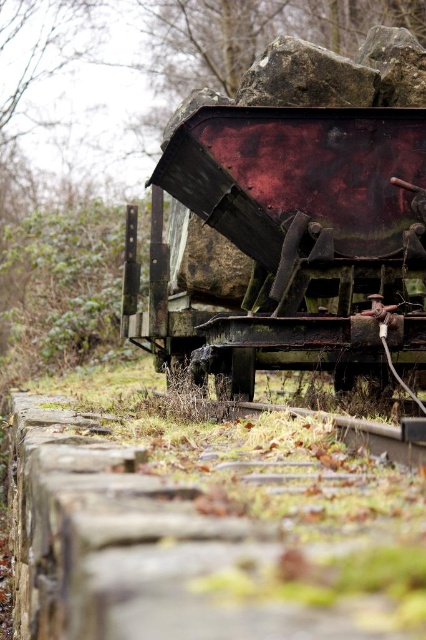
Question: Considering the relative positions of rusty metal train car at center and rusty metal rock at upper center in the image provided, where is rusty metal train car at center located with respect to rusty metal rock at upper center?

Choices:
 (A) above
 (B) below

Answer: (B)

Question: Can you confirm if rusty metal train car at center is positioned above rusty metal rock at upper center?

Choices:
 (A) no
 (B) yes

Answer: (A)

Question: Is rusty metal train car at center wider than rusty metal rock at upper center?

Choices:
 (A) no
 (B) yes

Answer: (B)

Question: Which object is farther from the camera taking this photo?

Choices:
 (A) rusty metal rock at upper center
 (B) rusty metal train car at center

Answer: (A)